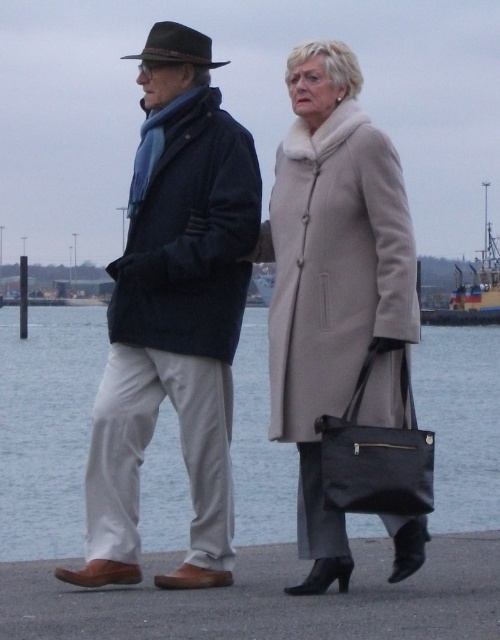
In the scene shown: Is velvet blue scarf at left taller than beige wool coat at center?

Indeed, velvet blue scarf at left has a greater height compared to beige wool coat at center.

Between velvet blue scarf at left and beige wool coat at center, which one appears on the left side from the viewer's perspective?

Positioned to the left is velvet blue scarf at left.

What do you see at coordinates (174, 316) in the screenshot?
I see `velvet blue scarf at left` at bounding box center [174, 316].

Where is `velvet blue scarf at left`? This screenshot has width=500, height=640. velvet blue scarf at left is located at coordinates (174, 316).

Between clear water at lower center and metallic gray boat at center, which one appears on the left side from the viewer's perspective?

From the viewer's perspective, clear water at lower center appears more on the left side.

Does clear water at lower center appear under metallic gray boat at center?

Yes.

Which is in front, point (66, 422) or point (498, 275)?

Point (66, 422)

Where is `clear water at lower center`? The height and width of the screenshot is (640, 500). clear water at lower center is located at coordinates (46, 428).

Who is positioned more to the left, velvet blue scarf at left or metallic gray boat at center?

From the viewer's perspective, velvet blue scarf at left appears more on the left side.

Is point (158, 284) farther from viewer compared to point (481, 317)?

No, it is in front of (481, 317).

Locate an element on the screen. The height and width of the screenshot is (640, 500). velvet blue scarf at left is located at coordinates (174, 316).